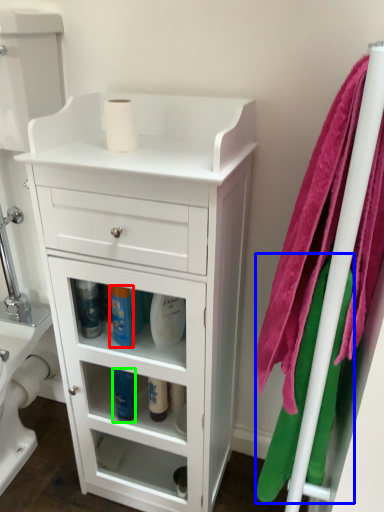
Question: Based on their relative distances, which object is farther from cleaning product (highlighted by a red box)? Choose from bath towel (highlighted by a blue box) and cleaning product (highlighted by a green box).

Choices:
 (A) bath towel
 (B) cleaning product

Answer: (A)